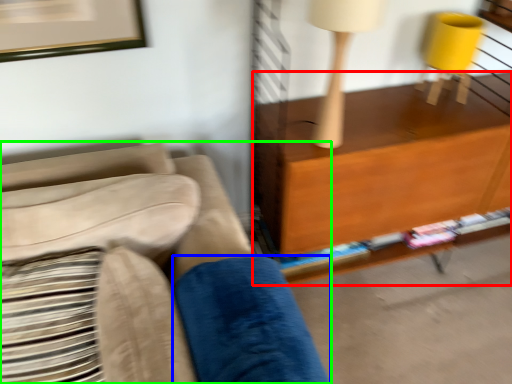
Question: Considering the real-world distances, which object is closest to shelf (highlighted by a red box)? pillow (highlighted by a blue box) or studio couch (highlighted by a green box).

Choices:
 (A) pillow
 (B) studio couch

Answer: (A)